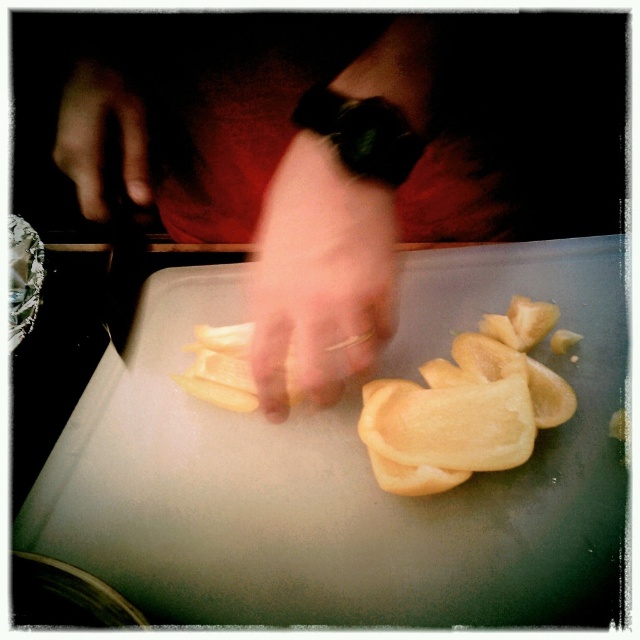
Can you confirm if yellow matte apple slices at center is positioned above smooth skin hand at upper left?

Incorrect, yellow matte apple slices at center is not positioned above smooth skin hand at upper left.

Is point (474, 468) farther from viewer compared to point (74, 145)?

That is False.

In order to click on yellow matte apple slices at center in this screenshot , I will do point(467,406).

Which is behind, point (176, 83) or point (88, 200)?

The point (176, 83) is more distant.

Can you confirm if yellow matte onion at center is shorter than smooth skin hand at upper left?

No.

Does point (288, 68) come behind point (84, 129)?

Yes.

I want to click on yellow matte onion at center, so pos(294,164).

From the picture: Can you confirm if yellow matte onion at center is positioned to the right of pale skin at center?

No, yellow matte onion at center is not to the right of pale skin at center.

Between yellow matte onion at center and pale skin at center, which one appears on the right side from the viewer's perspective?

pale skin at center

Does point (144, 52) lie in front of point (278, 353)?

No.

Where is `yellow matte onion at center`? The image size is (640, 640). yellow matte onion at center is located at coordinates (294, 164).